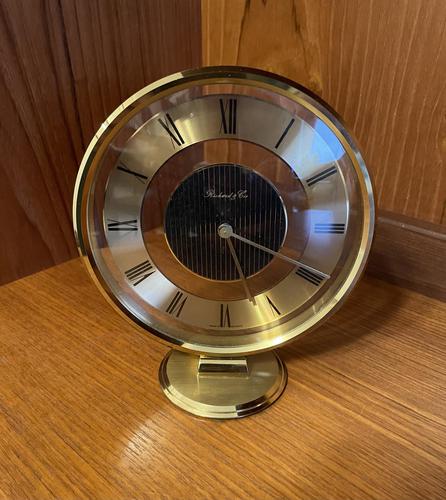
At what (x,y) coordinates should I click in order to perform the action: click on clock base. Please return your answer as a coordinate pair (x, y). This screenshot has width=446, height=500. Looking at the image, I should click on (220, 395).